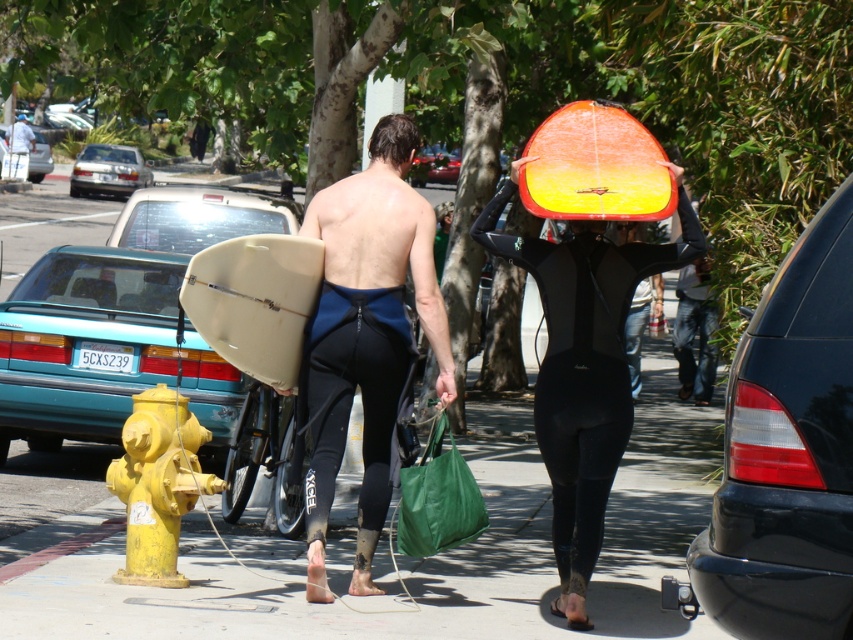
Question: Which object appears farthest from the camera in this image?

Choices:
 (A) teal matte car at left
 (B) silver metallic sedan at upper left
 (C) orange/yellow surfboard at upper center

Answer: (B)

Question: Is matte black wetsuit at center above teal matte car at center-left?

Choices:
 (A) yes
 (B) no

Answer: (B)

Question: Which point appears farthest from the camera in this image?

Choices:
 (A) (793, 556)
 (B) (219, 353)

Answer: (B)

Question: Which object appears closest to the camera in this image?

Choices:
 (A) brown matte hair at center
 (B) matte black wetsuit at center
 (C) black neoprene wetsuit at center
 (D) shiny black car at right

Answer: (D)

Question: Where is teal matte car at left located in relation to shiny orange surfboard at upper center in the image?

Choices:
 (A) below
 (B) above

Answer: (A)

Question: Is black neoprene wetsuit at center positioned in front of silver metallic sedan at upper left?

Choices:
 (A) no
 (B) yes

Answer: (B)